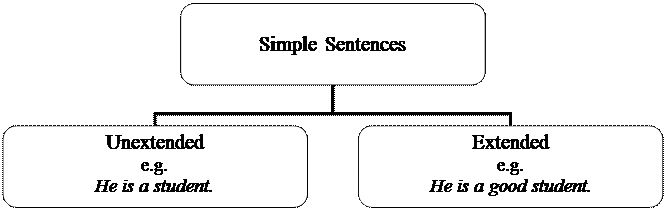
What are the coordinates of `corner` in the screenshot? It's located at (155, 115).